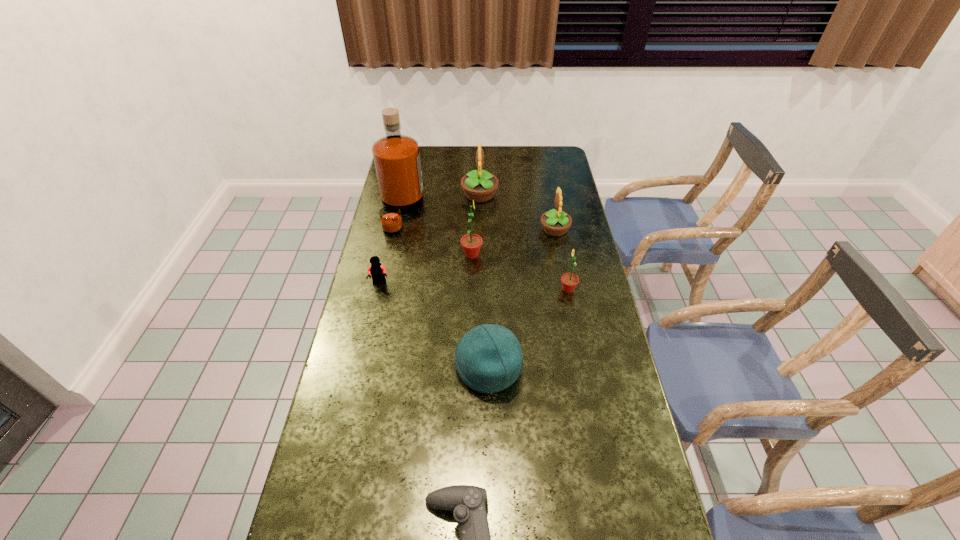
Where is `the tallest object`? The image size is (960, 540). the tallest object is located at coordinates (396, 157).

This screenshot has height=540, width=960. In order to click on the farthest sunflower in this screenshot , I will do `click(479, 185)`.

At what (x,y) coordinates should I click in order to perform the action: click on the bigger yellow sunflower. Please return your answer as a coordinate pair (x, y). Looking at the image, I should click on (479, 185).

You are a GUI agent. You are given a task and a screenshot of the screen. Output one action in this format:
    pyautogui.click(x=<x>, y=<y>)
    Task: Click on the left green sunflower
    This screenshot has width=960, height=540.
    Given the screenshot: What is the action you would take?
    pyautogui.click(x=471, y=243)

Find the location of a particular element. Image resolution: width=960 pixels, height=540 pixels. the third farthest sunflower is located at coordinates (471, 243).

Locate an element on the screen. This screenshot has width=960, height=540. the right yellow sunflower is located at coordinates (555, 223).

Identify the location of the nearer yellow sunflower. The width and height of the screenshot is (960, 540). (555, 223).

Where is `the smaller green sunflower`? Image resolution: width=960 pixels, height=540 pixels. the smaller green sunflower is located at coordinates (569, 281).

The width and height of the screenshot is (960, 540). I want to click on the right green sunflower, so coord(569,281).

In order to click on the sixth tallest object in this screenshot , I will do `click(488, 358)`.